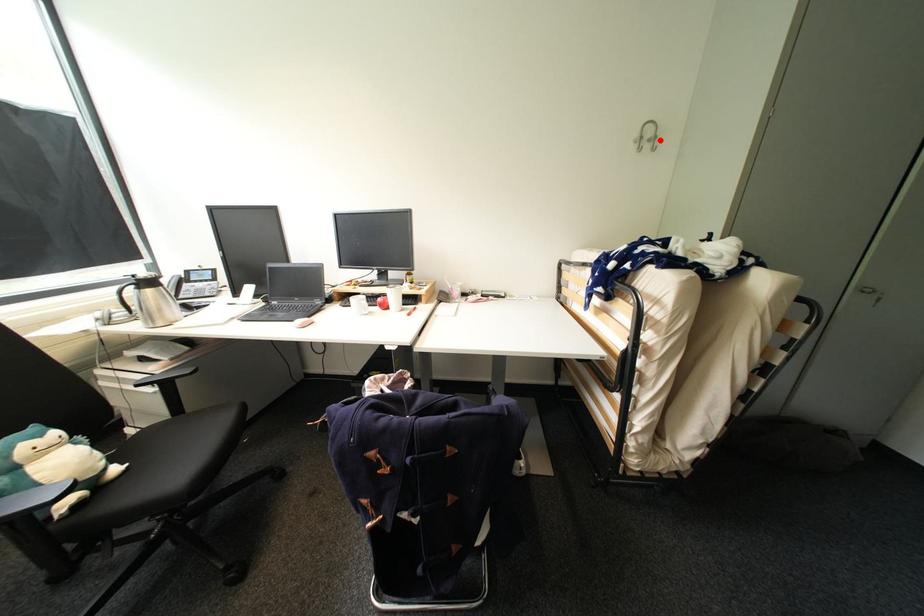
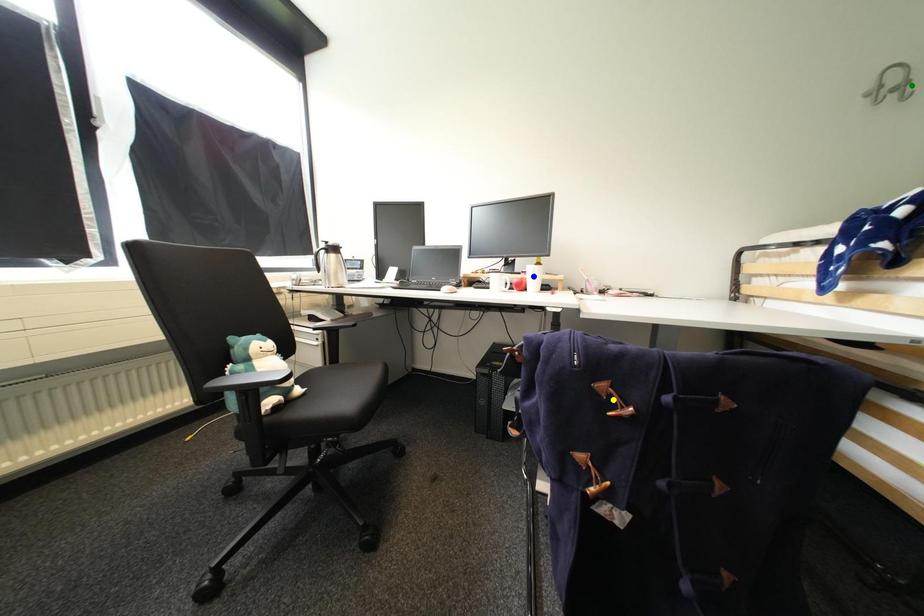
Question: I am providing you with two images of the same scene from different viewpoints. A red point is marked on the first image. You are given multiple points on the second image. Which mark in image 2 goes with the point in image 1?

Choices:
 (A) yellow point
 (B) green point
 (C) blue point

Answer: (B)